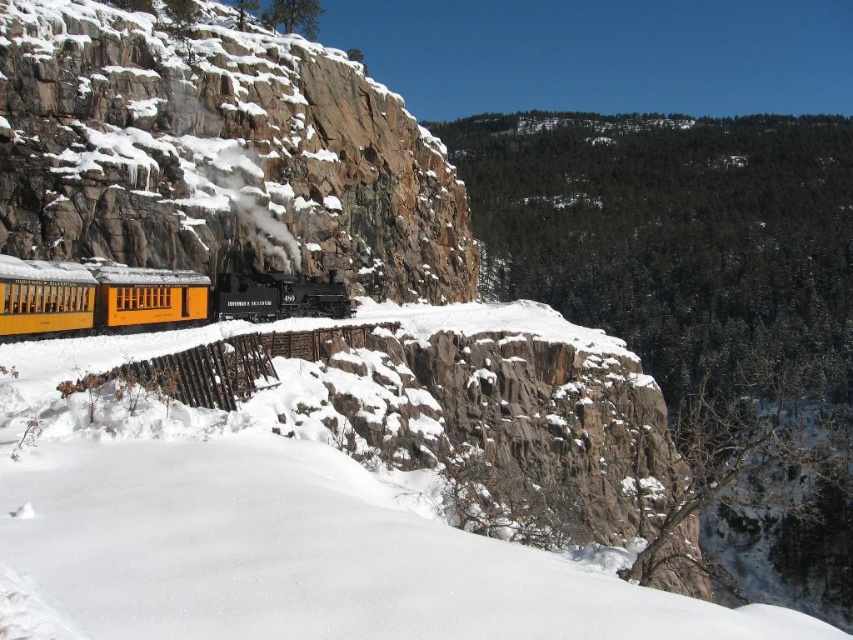
You are a photographer planning to capture the steam locomotive labeled 480 and the rocky cliff at center in a single frame. Given that the camera has a field of view of 60 degrees, can you determine if both objects will fit within the frame?

The rocky cliff at center is located at coordinates point (x=218, y=154). Since the camera has a 60 degree field of view, it is possible to capture both the steam locomotive labeled 480 and the rocky cliff at center within the frame if their positions fall within the 60 degree angle. However, without knowing the exact distance and spatial relationship between the two objects, it is impossible to confirm definitively.

You are a photographer standing at the camera position in the image. You want to capture a closeup shot of the rocky cliff at center. What is the minimum distance you need to move forward to get the cliff into focus?

The rocky cliff at center is 44.04 meters away from the camera. To capture a closeup shot, you would need to move forward until the distance between you and the cliff is reduced to the minimum focusing distance of your camera lens. Without knowing the lens specifications, it is impossible to determine the exact distance to move.